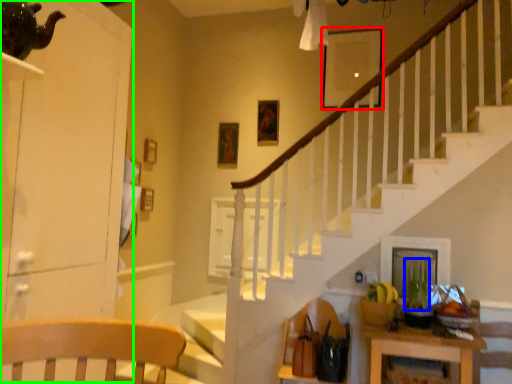
Question: Which object is positioned farthest from picture frame (highlighted by a red box)? Select from plant (highlighted by a blue box) and dresser (highlighted by a green box).

Choices:
 (A) plant
 (B) dresser

Answer: (B)